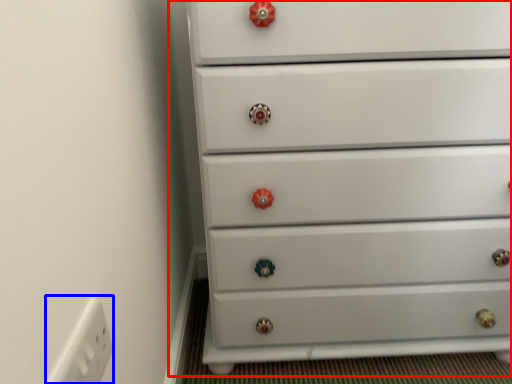
Question: Which of the following is the closest to the observer, chest of drawers (highlighted by a red box) or electric outlet (highlighted by a blue box)?

Choices:
 (A) chest of drawers
 (B) electric outlet

Answer: (B)